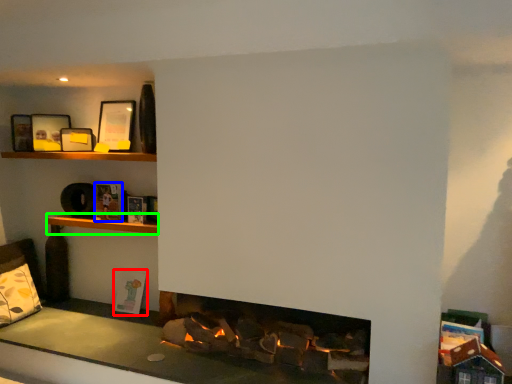
Question: Which object is the farthest from book (highlighted by a red box)? Choose among these: book (highlighted by a blue box) or shelf (highlighted by a green box).

Choices:
 (A) book
 (B) shelf

Answer: (A)